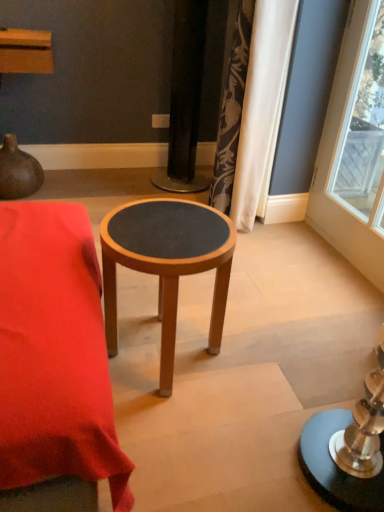
Question: From a real-world perspective, is wooden stool at center above or below brown matte vase at upper left?

Choices:
 (A) above
 (B) below

Answer: (A)

Question: Based on their sizes in the image, would you say wooden stool at center is bigger or smaller than brown matte vase at upper left?

Choices:
 (A) small
 (B) big

Answer: (B)

Question: Considering the real-world distances, which object is closest to the wooden stool at center?

Choices:
 (A) brown matte vase at upper left
 (B) wooden stool at center
 (C) silky floral curtain at upper right

Answer: (B)

Question: Based on their relative distances, which object is nearer to the wooden stool at center?

Choices:
 (A) brown matte vase at upper left
 (B) silky floral curtain at upper right
 (C) wooden stool at center

Answer: (C)